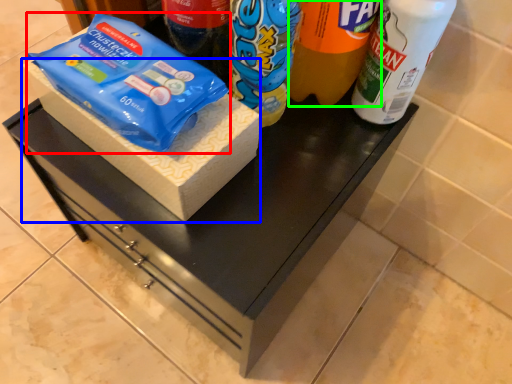
Question: Which object is the closest to the food (highlighted by a red box)? Choose among these: box (highlighted by a blue box) or drinking straw (highlighted by a green box).

Choices:
 (A) box
 (B) drinking straw

Answer: (A)